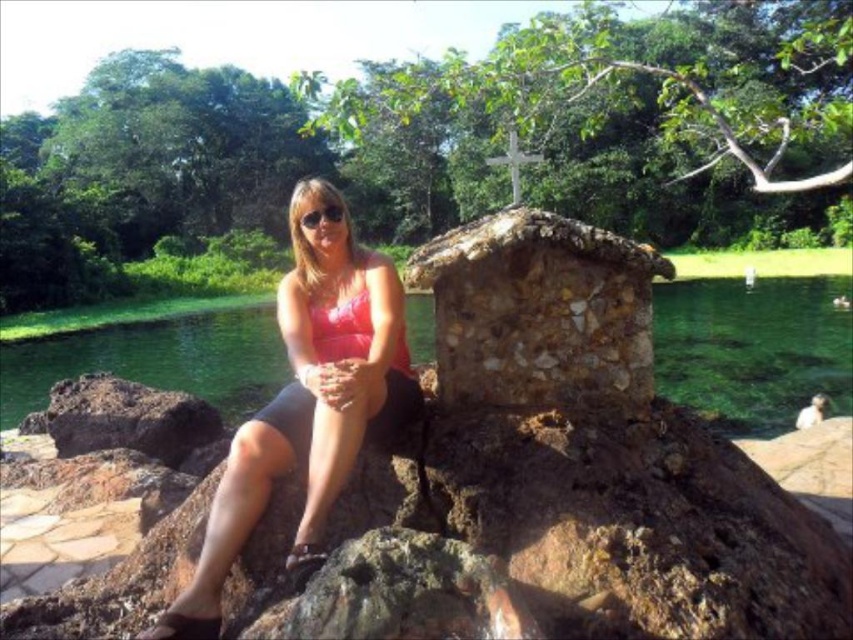
Does pink matte bikini top at center have a greater width compared to matte black goggles at center?

Indeed, pink matte bikini top at center has a greater width compared to matte black goggles at center.

Is pink matte bikini top at center above matte black goggles at center?

Actually, pink matte bikini top at center is below matte black goggles at center.

What do you see at coordinates (344, 323) in the screenshot? I see `pink matte bikini top at center` at bounding box center [344, 323].

You are a GUI agent. You are given a task and a screenshot of the screen. Output one action in this format:
    pyautogui.click(x=<x>, y=<y>)
    Task: Click on the pink matte bikini top at center
    
    Given the screenshot: What is the action you would take?
    pyautogui.click(x=344, y=323)

From the picture: Between clear water at center and pink fabric at center, which one has less height?

pink fabric at center is shorter.

The width and height of the screenshot is (853, 640). What do you see at coordinates (752, 348) in the screenshot?
I see `clear water at center` at bounding box center [752, 348].

Locate an element on the screen. Image resolution: width=853 pixels, height=640 pixels. clear water at center is located at coordinates (752, 348).

Who is taller, dark brown rock at lower left or pink matte bikini top at center?

dark brown rock at lower left is taller.

What are the coordinates of `dark brown rock at lower left` in the screenshot? It's located at (126, 419).

Is point (80, 412) positioned before point (331, 348)?

No.

The height and width of the screenshot is (640, 853). In order to click on dark brown rock at lower left in this screenshot , I will do `click(126, 419)`.